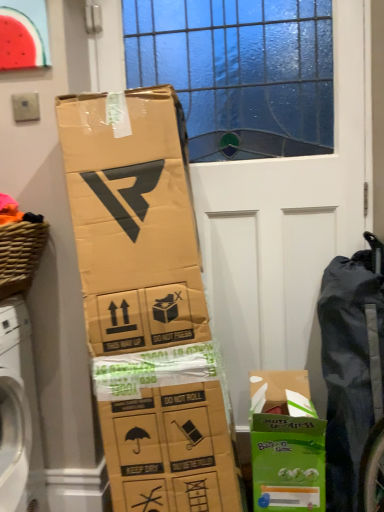
Question: From a real-world perspective, is black fabric bag at right under watermelon matte plastic at upper left?

Choices:
 (A) yes
 (B) no

Answer: (A)

Question: Is black fabric bag at right facing towards watermelon matte plastic at upper left?

Choices:
 (A) yes
 (B) no

Answer: (B)

Question: From the image's perspective, is black fabric bag at right on top of watermelon matte plastic at upper left?

Choices:
 (A) yes
 (B) no

Answer: (B)

Question: Is black fabric bag at right far away from watermelon matte plastic at upper left?

Choices:
 (A) yes
 (B) no

Answer: (A)

Question: Is watermelon matte plastic at upper left completely or partially inside black fabric bag at right?

Choices:
 (A) no
 (B) yes

Answer: (A)

Question: Can you confirm if black fabric bag at right is taller than watermelon matte plastic at upper left?

Choices:
 (A) no
 (B) yes

Answer: (B)

Question: Considering the relative positions of black fabric bag at right and green cardboard box at lower right in the image provided, is black fabric bag at right to the right of green cardboard box at lower right from the viewer's perspective?

Choices:
 (A) yes
 (B) no

Answer: (A)

Question: Considering the relative sizes of black fabric bag at right and green cardboard box at lower right in the image provided, is black fabric bag at right thinner than green cardboard box at lower right?

Choices:
 (A) no
 (B) yes

Answer: (B)

Question: Is black fabric bag at right turned away from green cardboard box at lower right?

Choices:
 (A) yes
 (B) no

Answer: (B)

Question: Would you say black fabric bag at right contains green cardboard box at lower right?

Choices:
 (A) yes
 (B) no

Answer: (B)

Question: Is black fabric bag at right with green cardboard box at lower right?

Choices:
 (A) no
 (B) yes

Answer: (A)

Question: Does black fabric bag at right have a larger size compared to green cardboard box at lower right?

Choices:
 (A) yes
 (B) no

Answer: (A)

Question: Is watermelon matte plastic at upper left located outside woven brown basket at left?

Choices:
 (A) no
 (B) yes

Answer: (B)